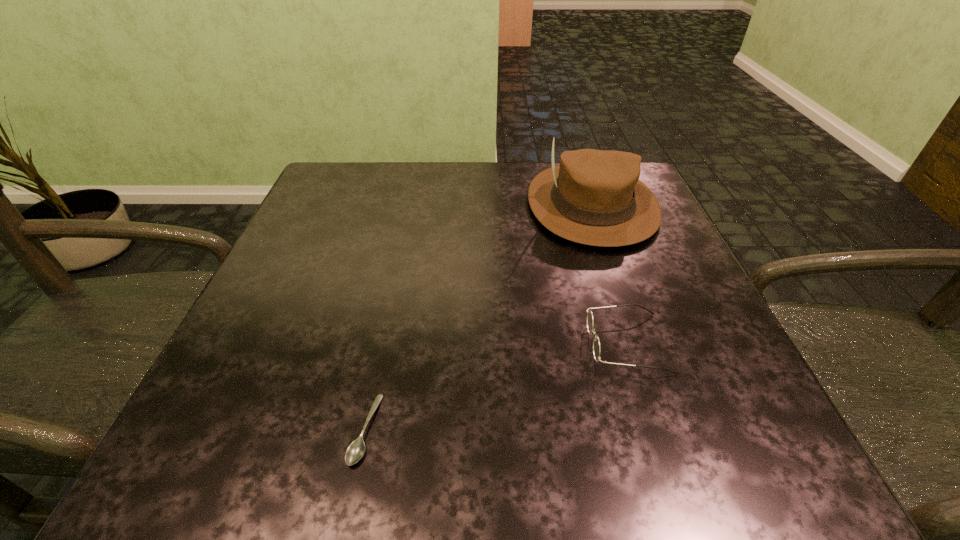
You are a GUI agent. You are given a task and a screenshot of the screen. Output one action in this format:
    pyautogui.click(x=<x>, y=<y>)
    Task: Click on the farthest object
    This screenshot has height=540, width=960.
    Given the screenshot: What is the action you would take?
    pyautogui.click(x=594, y=197)

Where is `fedora`? fedora is located at coordinates (594, 197).

Image resolution: width=960 pixels, height=540 pixels. I want to click on the second farthest object, so tap(596, 343).

Find the location of a particular element. This screenshot has height=540, width=960. the second tallest object is located at coordinates (596, 343).

Locate an element on the screen. The height and width of the screenshot is (540, 960). the leftmost object is located at coordinates (355, 451).

At what (x,y) coordinates should I click in order to perform the action: click on the nearest object. Please return your answer as a coordinate pair (x, y). This screenshot has height=540, width=960. Looking at the image, I should click on (355, 451).

Where is `vacant space situated on the feather side of the fedora`? This screenshot has height=540, width=960. vacant space situated on the feather side of the fedora is located at coordinates (657, 393).

Identify the location of vacant space located 0.250m through the lenses of the spectacles. (429, 343).

Locate an element on the screen. The image size is (960, 540). vacant area situated 0.080m through the lenses of the spectacles is located at coordinates (538, 343).

This screenshot has width=960, height=540. In order to click on vacant region located 0.060m through the lenses of the spectacles in this screenshot , I will do `click(551, 343)`.